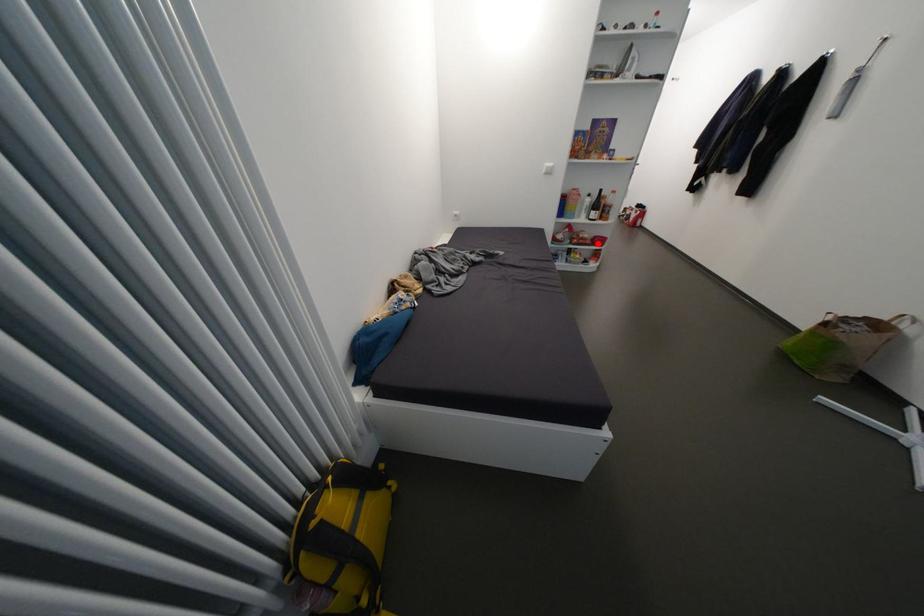
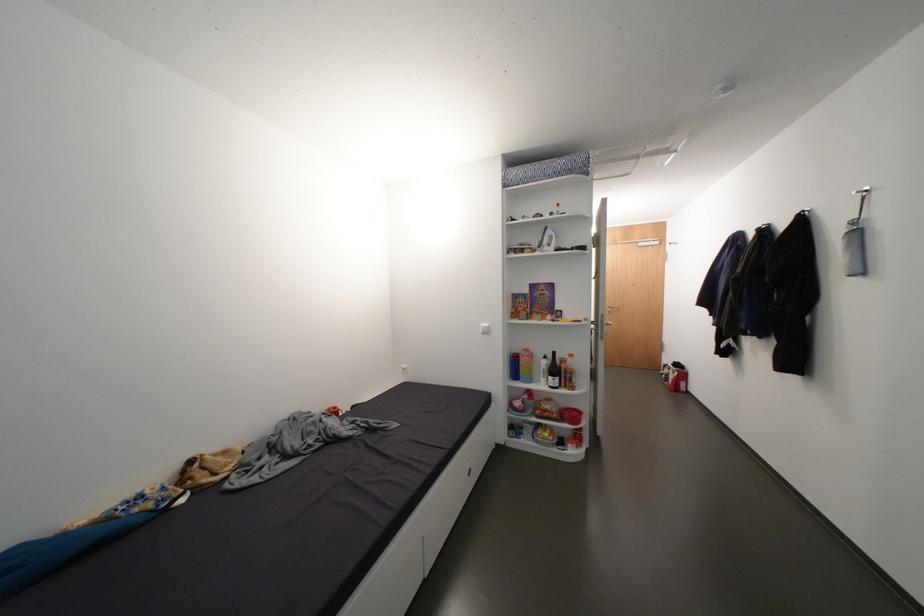
Find the pixel in the second image that matches the highlighted location in the first image.

(566, 418)